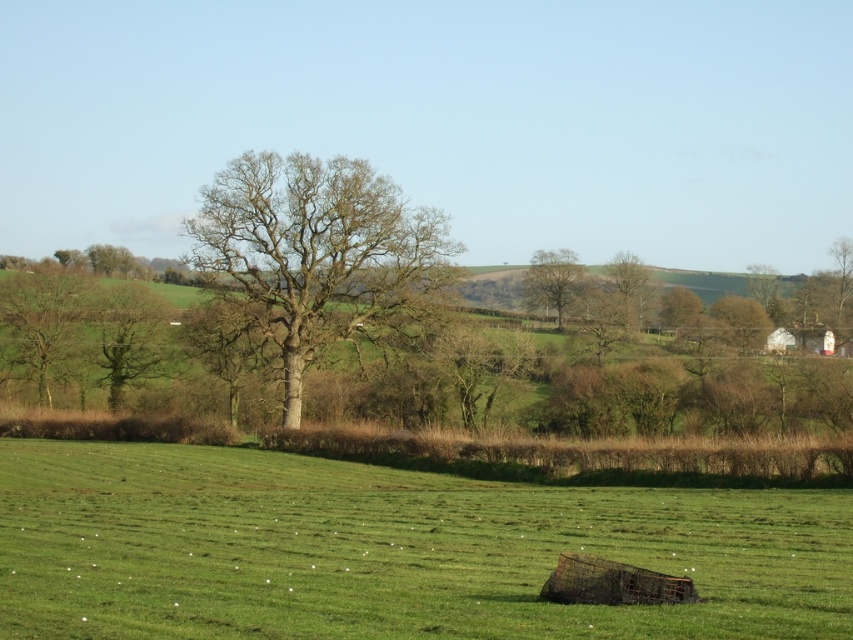
You are an environmental scientist studying the growth patterns of trees in this rural area. You observe the green leafy tree at left and the green leafy tree at center. Which tree would you recommend for a study on tree size variations, and why?

The green leafy tree at left has a smaller size compared to the green leafy tree at center. Therefore, the green leafy tree at left should be recommended for studying size variations as it provides a contrast in size with the larger central tree.

You are a bird looking for a nesting spot. You see a bare wood tree at center and a green leafy tree at upper left. Which tree is located above the other?

The bare wood tree at center is positioned over the green leafy tree at upper left.

You are standing at the point marked as point [318,252] in the image. What is located exactly at your current position?

At point [318,252] lies bare wood tree at center.